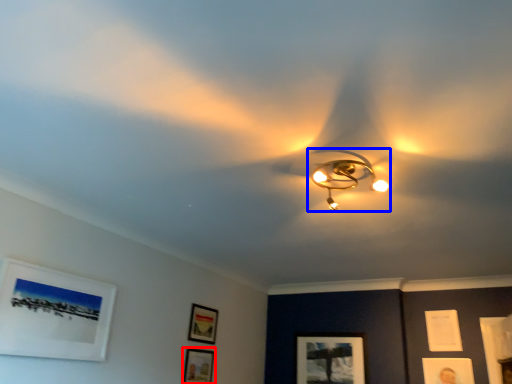
Question: Among these objects, which one is farthest to the camera, picture frame (highlighted by a red box) or lamp (highlighted by a blue box)?

Choices:
 (A) picture frame
 (B) lamp

Answer: (A)